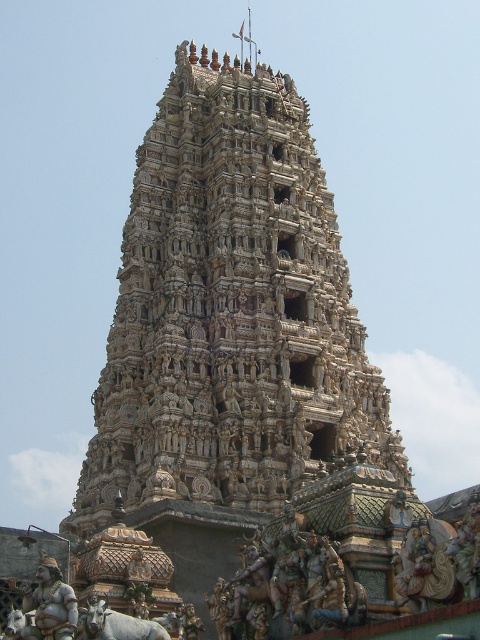
From the picture: Between carved stone temple at center and golden polished statue at lower left, which one is positioned higher?

Positioned higher is carved stone temple at center.

Between point (228, 465) and point (38, 568), which one is positioned in front?

Positioned in front is point (38, 568).

Who is more distant from viewer, (255, 164) or (59, 636)?

Positioned behind is point (255, 164).

Locate an element on the screen. carved stone temple at center is located at coordinates (229, 310).

Is carved stone temple at center above golden carved statue at center?

Correct, carved stone temple at center is located above golden carved statue at center.

Is point (176, 83) farther from camera compared to point (430, 538)?

Yes, it is.

Between point (171, 269) and point (418, 572), which one is positioned behind?

Point (171, 269)

Where is `carved stone temple at center`? The image size is (480, 640). carved stone temple at center is located at coordinates (229, 310).

The width and height of the screenshot is (480, 640). In order to click on golden carved statue at center in this screenshot , I will do `click(425, 564)`.

Is golden carved statue at center above golden polished statue at lower left?

Indeed, golden carved statue at center is positioned over golden polished statue at lower left.

Does point (440, 541) come closer to viewer compared to point (44, 625)?

Yes, point (440, 541) is closer to viewer.

Find the location of a particular element. The width and height of the screenshot is (480, 640). golden carved statue at center is located at coordinates (425, 564).